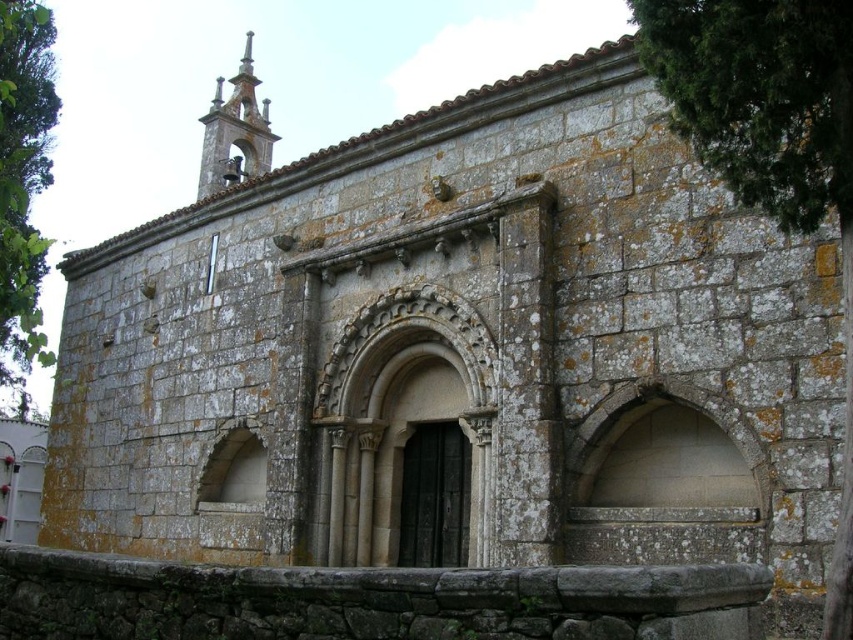
Question: Can you confirm if green mossy stone wall at upper right is positioned to the right of green leafy tree at left?

Choices:
 (A) yes
 (B) no

Answer: (A)

Question: Which of the following is the farthest from the observer?

Choices:
 (A) green leafy tree at left
 (B) green mossy stone wall at upper right

Answer: (A)

Question: Where is green mossy stone wall at upper right located in relation to green leafy tree at left in the image?

Choices:
 (A) above
 (B) below

Answer: (B)

Question: Considering the relative positions of green mossy stone wall at upper right and green leafy tree at left in the image provided, where is green mossy stone wall at upper right located with respect to green leafy tree at left?

Choices:
 (A) above
 (B) below

Answer: (B)